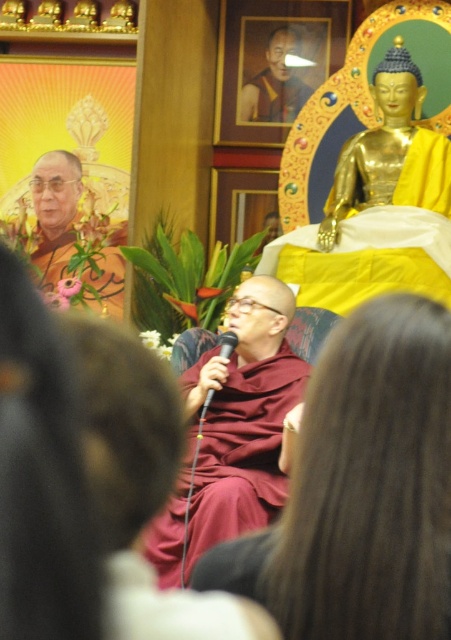
You are a photographer standing at the camera position. You need to capture a closeup shot of the maroon cloth at center. Considering the distance, will you need to use a zoom lens?

The maroon cloth at center is 21.93 meters away from the camera, so yes, you will need to use a zoom lens to capture a closeup shot.

You are an interior designer planning to hang a new artwork between the gold polished buddha at upper right and the golden statue at upper left. Given their sizes, which one should you consider for alignment purposes?

The gold polished buddha at upper right is taller than the golden statue at upper left, so you should align the new artwork with the height of the gold polished buddha at upper right to maintain visual balance.